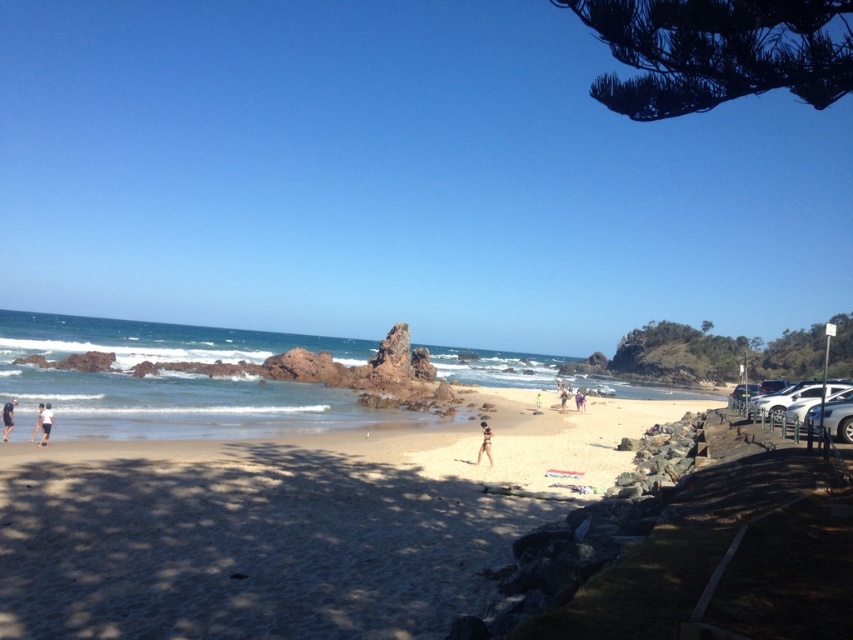
You are a photographer trying to capture the scene. You have two subjects in your viewfinder, the tan skin person at center and the matte white shorts at lower left. Which subject would appear narrower in your photo?

The tan skin person at center is thinner than the matte white shorts at lower left, so it would appear narrower in the photo.

You are a photographer standing on the beach and want to take a photo of the black fabric person at lower left and the matte white shorts at lower left. Which object is positioned closer to you?

The black fabric person at lower left is closer to the viewer than matte white shorts at lower left.

You are standing on the beach and see two points marked on the sand. The first point is at coordinates point (47, 417) and the second is at point (39, 413). Which point is closer to you?

Point (47, 417) is closer to the camera than point (39, 413), so the first point is closer to you.